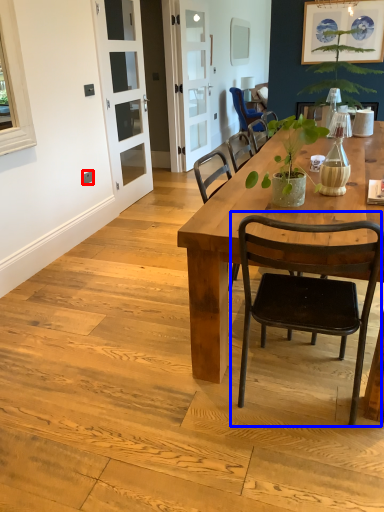
Question: Which point is further to the camera, power outlet (highlighted by a red box) or chair (highlighted by a blue box)?

Choices:
 (A) power outlet
 (B) chair

Answer: (A)